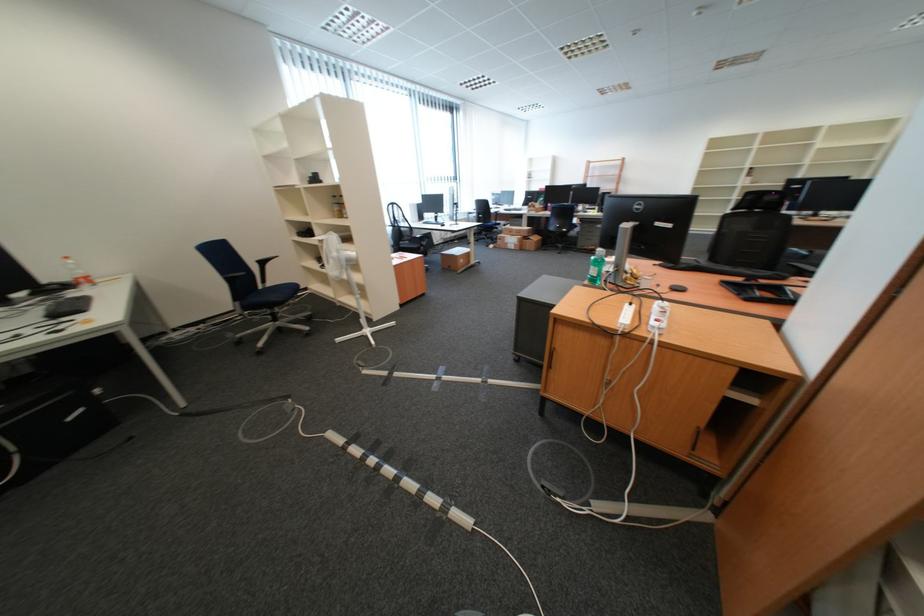
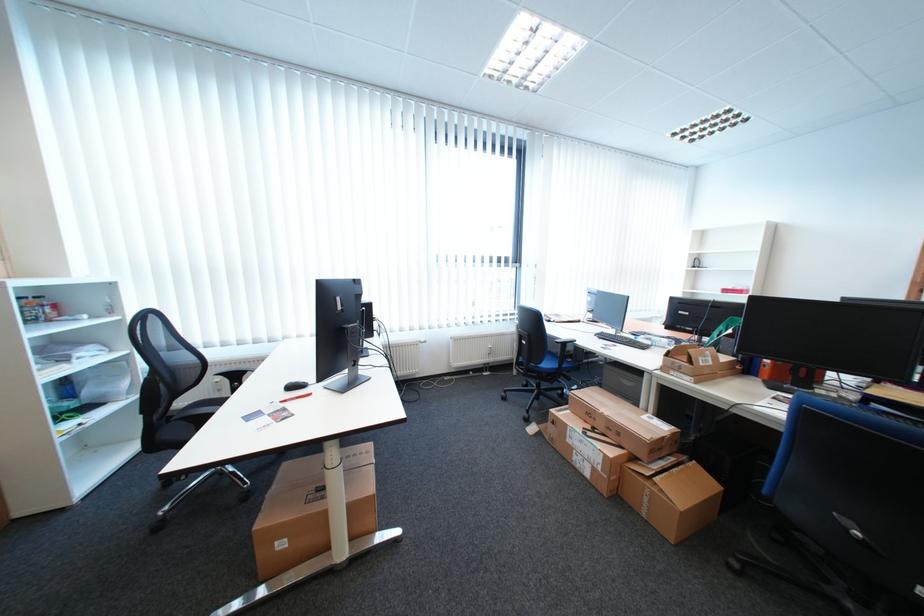
Where in the second image is the point corresponding to point (517, 243) from the first image?

(580, 442)